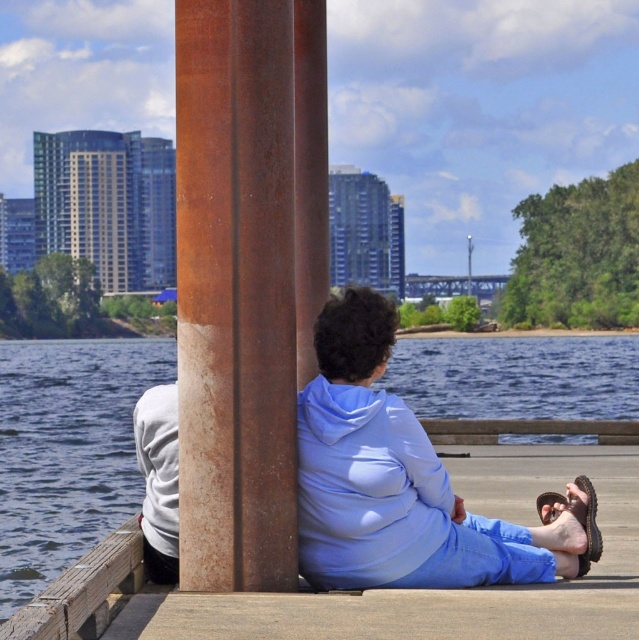
You are standing on the wooden dock and want to take a photo of the light blue hoodie at center without the rusty metal pole at left blocking the view. Which direction should you move to ensure the pole is out of the frame?

You should move to the right side of the dock because the rusty metal pole at left is in front of the light blue hoodie at center, so moving right would position the pole behind you and keep the hoodie visible.

You are a photographer trying to capture both the light blue hoodie at center and the white matte hoodie at lower left in a single frame. Which hoodie should you focus on first to ensure both are in the frame?

The light blue hoodie at center is larger than the white matte hoodie at lower left, so you should focus on the light blue hoodie at center first to ensure both are in the frame.